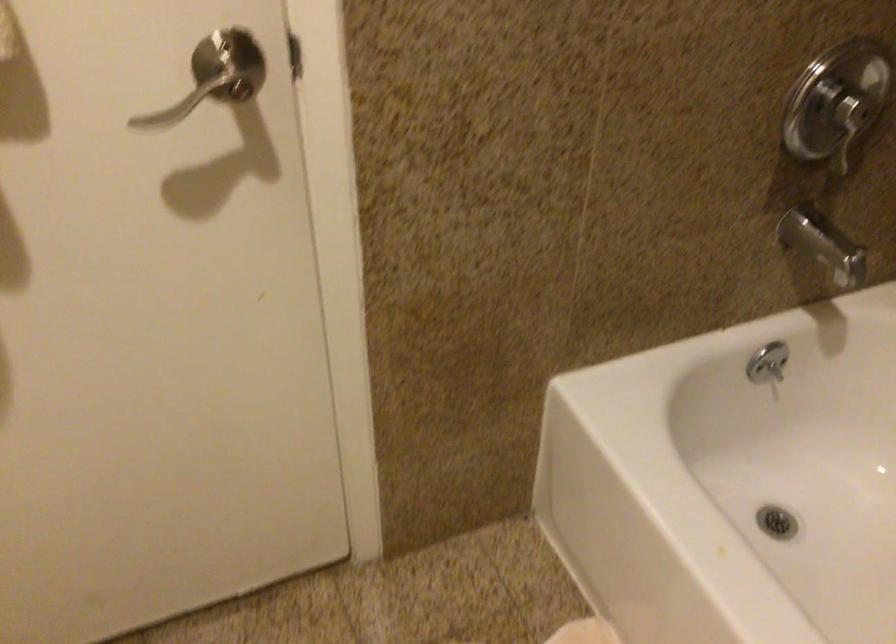
Find the location of a particular element. The width and height of the screenshot is (896, 644). door handle is located at coordinates (178, 106).